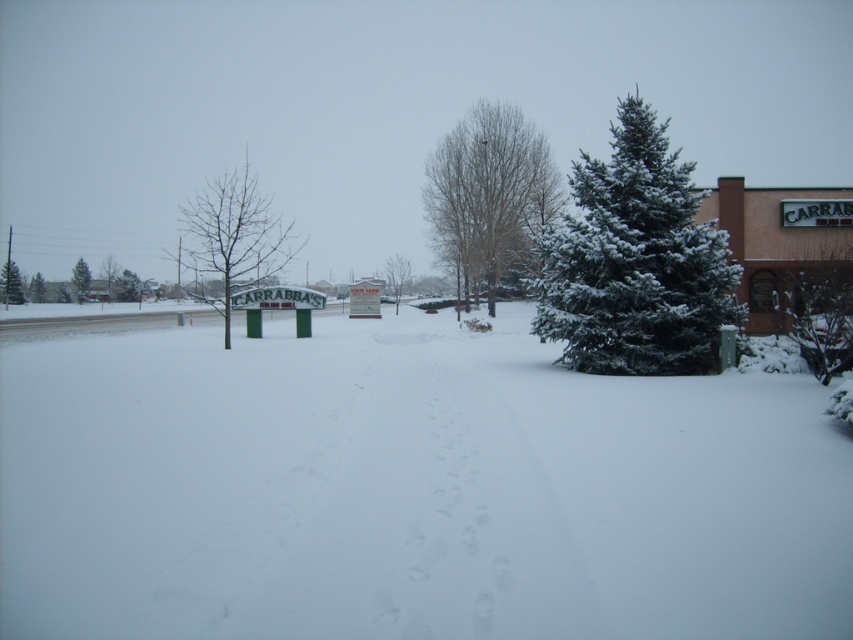
You are standing in front of the Carrabba Italian Grill restaurant and see two points marked in the snow. One is at point (308, 308) and the other is at point (84, 294). Which point is closer to you?

Point (308, 308) is closer to the viewer than point (84, 294).